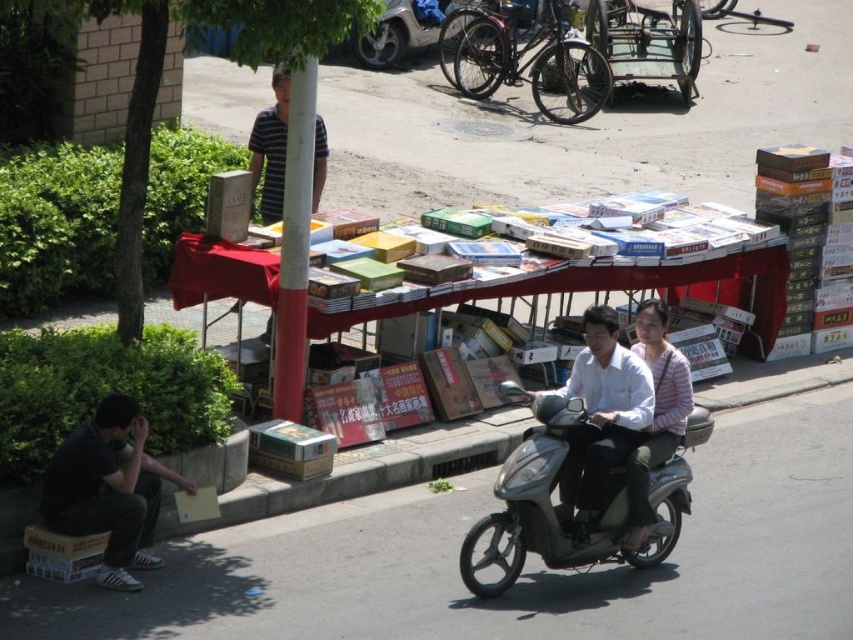
Question: Which of the following is the farthest from the observer?

Choices:
 (A) striped shirt at upper center
 (B) metallic gray scooter at lower center
 (C) white glossy shirt at center
 (D) metallic silver motorcycle at upper center

Answer: (D)

Question: Can you confirm if dark gray fabric pants at lower left is positioned to the right of white glossy shirt at center?

Choices:
 (A) yes
 (B) no

Answer: (B)

Question: Can you confirm if metallic silver motorcycle at upper center is positioned below striped shirt at upper center?

Choices:
 (A) no
 (B) yes

Answer: (A)

Question: Among these points, which one is nearest to the camera?

Choices:
 (A) (703, 433)
 (B) (560, 388)

Answer: (A)

Question: Which object appears closest to the camera in this image?

Choices:
 (A) matte white shirt at center
 (B) metallic silver motorcycle at upper center
 (C) striped shirt at upper center
 (D) white glossy shirt at center

Answer: (D)

Question: Does dark gray fabric pants at lower left have a smaller size compared to white glossy shirt at center?

Choices:
 (A) yes
 (B) no

Answer: (A)